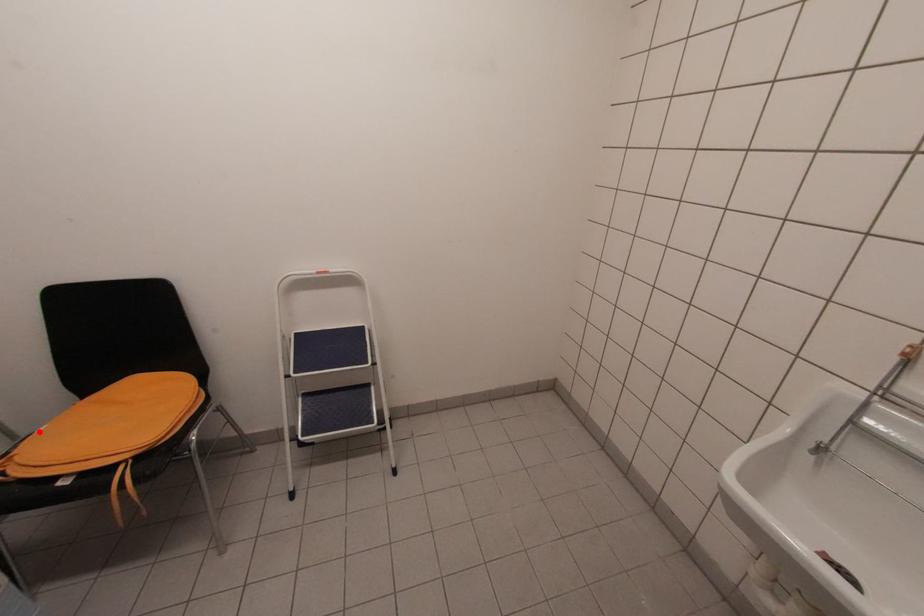
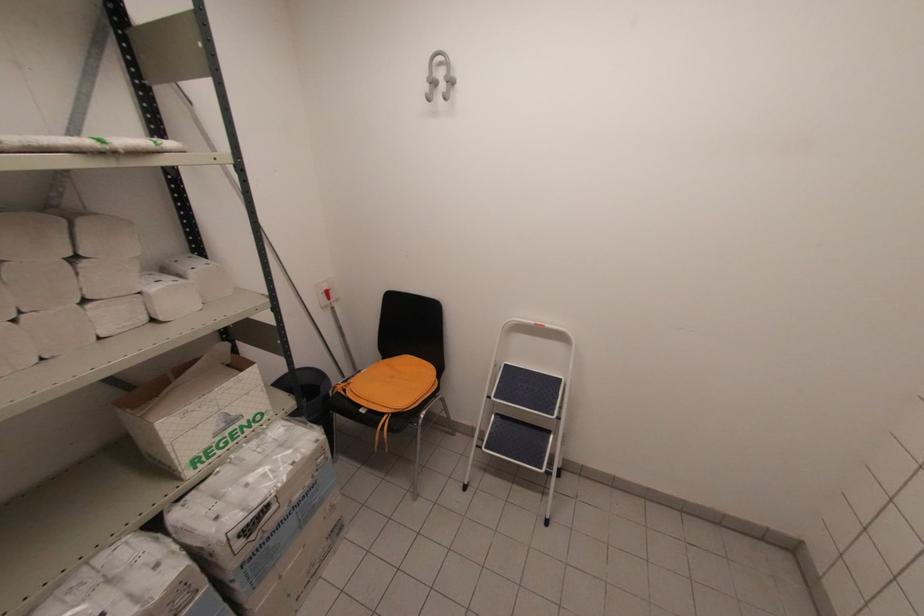
Question: I am providing you with two images of the same scene from different viewpoints. Image1 has a red point marked. In image2, the corresponding 3D location appears at what relative position? Reply with the corresponding letter.

Choices:
 (A) Closer
 (B) Farther

Answer: (A)